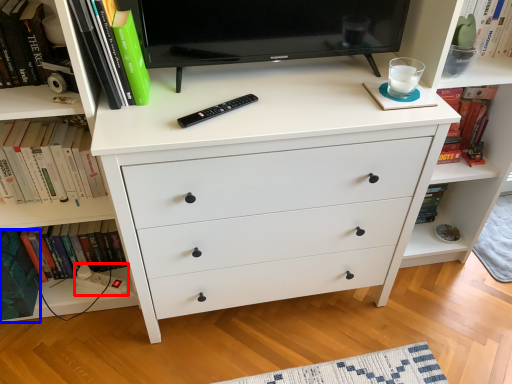
Question: Which point is closer to the camera, plug (highlighted by a red box) or paperback book (highlighted by a blue box)?

Choices:
 (A) plug
 (B) paperback book

Answer: (B)